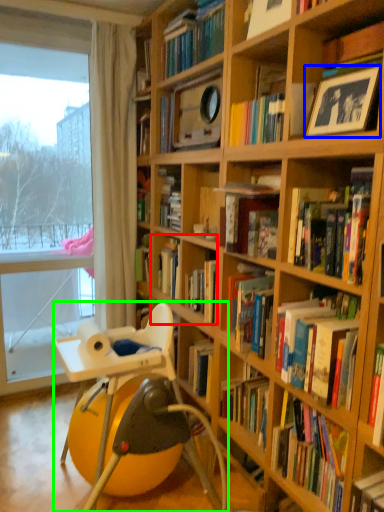
Question: Which is nearer to the book (highlighted by a red box)? paperback book (highlighted by a blue box) or chair (highlighted by a green box).

Choices:
 (A) paperback book
 (B) chair

Answer: (B)